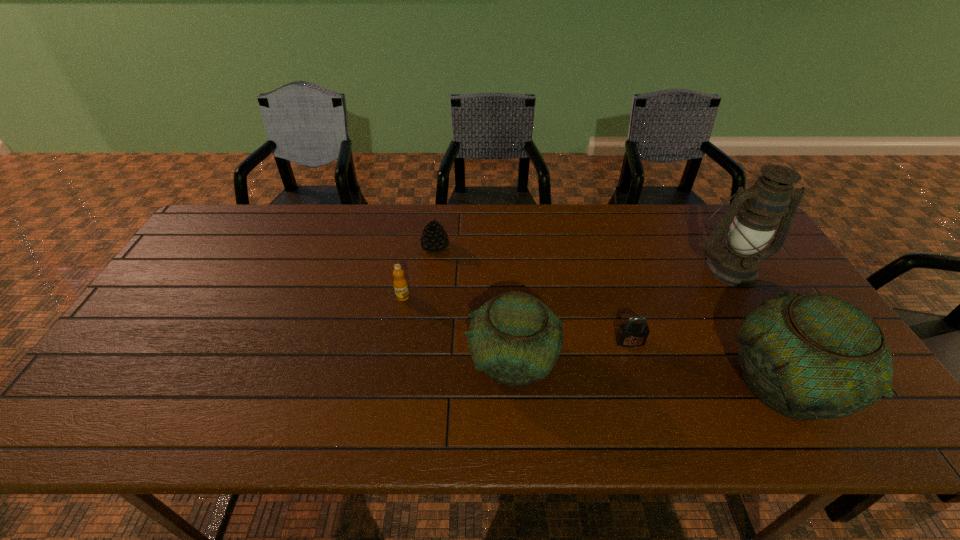
Please show where to add a pottery on the left while keeping spacing even. Please provide its 2D coordinates. Your answer should be formatted as a tuple, i.e. [(x, y)], where the tuple contains the x and y coordinates of a point satisfying the conditions above.

[(262, 339)]